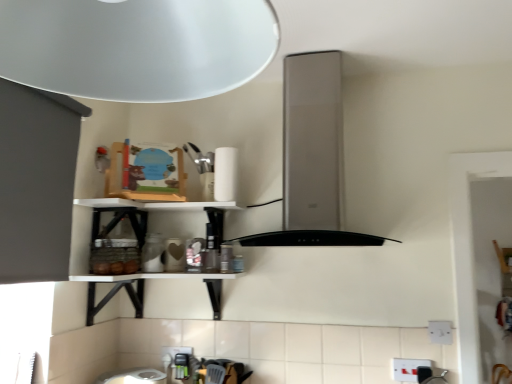
I want to click on free point above satin silver vent at center (from a real-world perspective), so click(321, 43).